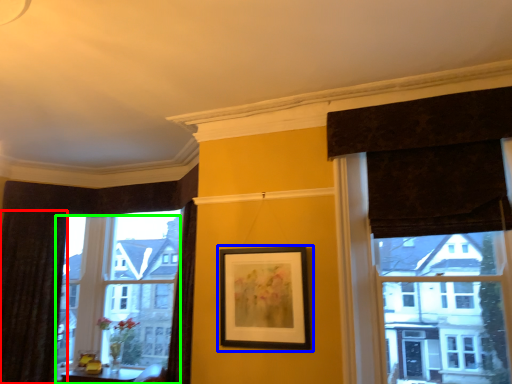
Question: Which object is positioned closest to curtain (highlighted by a red box)? Select from picture frame (highlighted by a blue box) and window (highlighted by a green box).

Choices:
 (A) picture frame
 (B) window

Answer: (B)